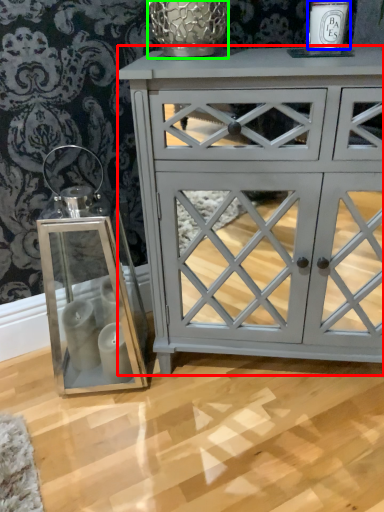
Question: Which is nearer to the chest of drawers (highlighted by a red box)? candle holder (highlighted by a blue box) or glass vase (highlighted by a green box).

Choices:
 (A) candle holder
 (B) glass vase

Answer: (B)